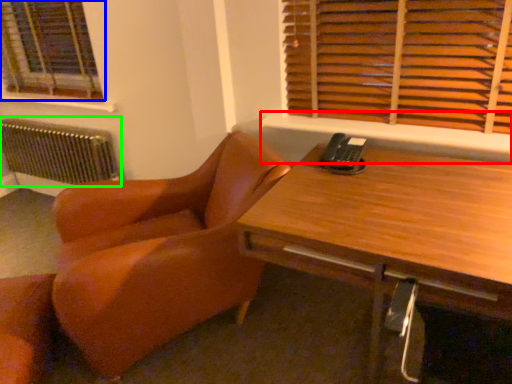
Question: Estimate the real-world distances between objects in this image. Which object is farther from window sill (highlighted by a red box), window (highlighted by a blue box) or radiator (highlighted by a green box)?

Choices:
 (A) window
 (B) radiator

Answer: (A)